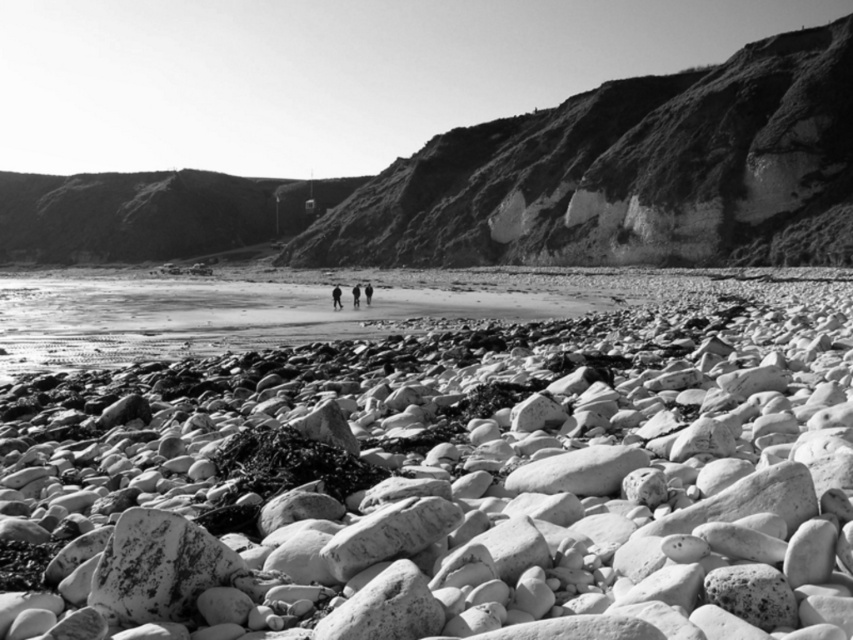
Based on the provided scene description, where exactly is the dark fabric figure at center located in terms of coordinates?

The dark fabric figure at center is located at point coordinates of (335, 296).